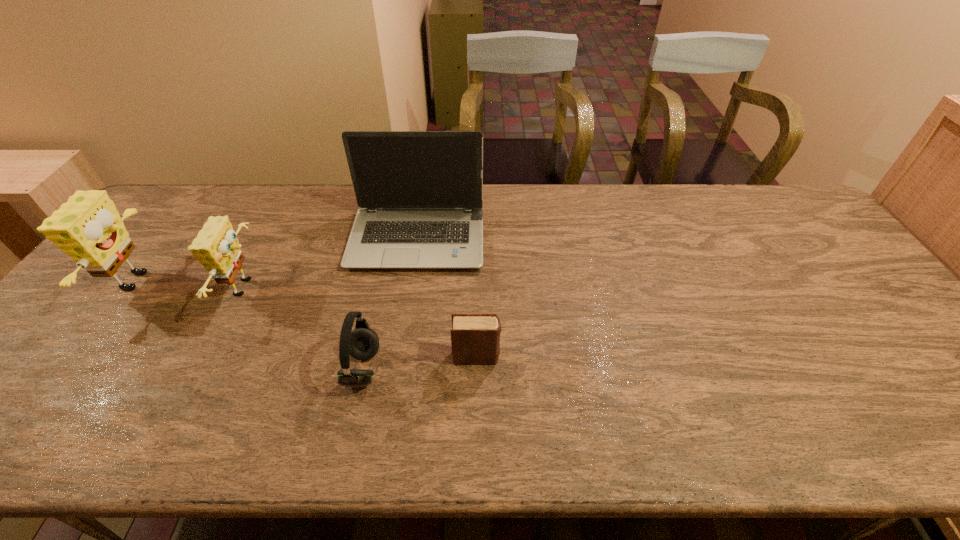
Locate an element on the screen. The image size is (960, 540). laptop computer is located at coordinates (420, 193).

You are a GUI agent. You are given a task and a screenshot of the screen. Output one action in this format:
    pyautogui.click(x=<x>, y=<y>)
    Task: Click on the leftmost object
    Image resolution: width=960 pixels, height=540 pixels.
    Given the screenshot: What is the action you would take?
    pyautogui.click(x=88, y=228)

Where is `the left sponge`? This screenshot has height=540, width=960. the left sponge is located at coordinates (88, 228).

Locate an element on the screen. The image size is (960, 540). the right sponge is located at coordinates (216, 247).

Identify the location of the shorter sponge. 216,247.

Locate an element on the screen. Image resolution: width=960 pixels, height=540 pixels. the fourth tallest object is located at coordinates (362, 343).

You are a GUI agent. You are given a task and a screenshot of the screen. Output one action in this format:
    pyautogui.click(x=<x>, y=<y>)
    Task: Click on the diary
    The image size is (960, 540).
    Given the screenshot: What is the action you would take?
    pyautogui.click(x=475, y=338)

At what (x,y) coordinates should I click in order to perform the action: click on vacant space located 0.210m on the screen of the laptop computer. Please return your answer as a coordinate pair (x, y). Looking at the image, I should click on (403, 333).

At what (x,y) coordinates should I click in order to perform the action: click on vacant space situated 0.370m on the front-facing side of the taller sponge. Please return your answer as a coordinate pair (x, y). The image size is (960, 540). Looking at the image, I should click on (290, 281).

Identify the location of vacant space located 0.150m on the face of the third tallest object. (316, 287).